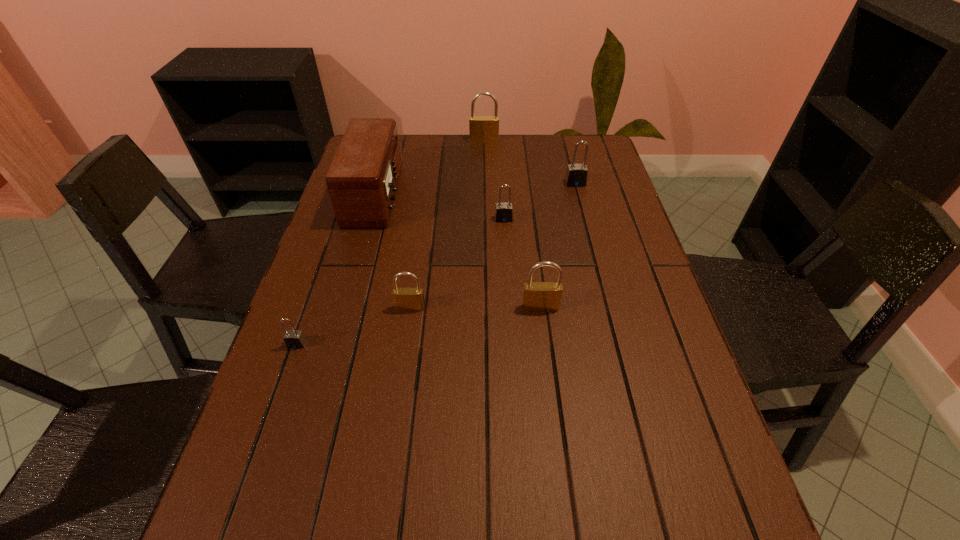
The image size is (960, 540). Identify the location of the fifth object from right to left. (405, 299).

Where is `the shortest padlock`? The height and width of the screenshot is (540, 960). the shortest padlock is located at coordinates (293, 339).

This screenshot has height=540, width=960. I want to click on the leftmost padlock, so click(x=293, y=339).

The height and width of the screenshot is (540, 960). Identify the location of vacant area situated on the front-facing side of the farthest padlock. (485, 191).

I want to click on vacant space located 0.310m on the front-facing side of the radio receiver, so click(x=501, y=195).

Locate an element on the screen. vacant space situated on the shackle of the rightmost gray padlock is located at coordinates (598, 273).

I want to click on vacant space located 0.380m on the front-facing side of the second biggest brass padlock, so click(562, 478).

You are a GUI agent. You are given a task and a screenshot of the screen. Output one action in this format:
    pyautogui.click(x=<x>, y=<y>)
    Task: Click on the free region located 0.190m on the shackle of the second smallest gray padlock
    
    Given the screenshot: What is the action you would take?
    pyautogui.click(x=507, y=269)

The height and width of the screenshot is (540, 960). In order to click on vacant space situated 0.210m on the front-facing side of the second padlock from left to right in this screenshot , I will do `click(398, 391)`.

This screenshot has height=540, width=960. Identify the location of vacant space located 0.150m on the shackle of the leftmost padlock. pyautogui.click(x=273, y=413).